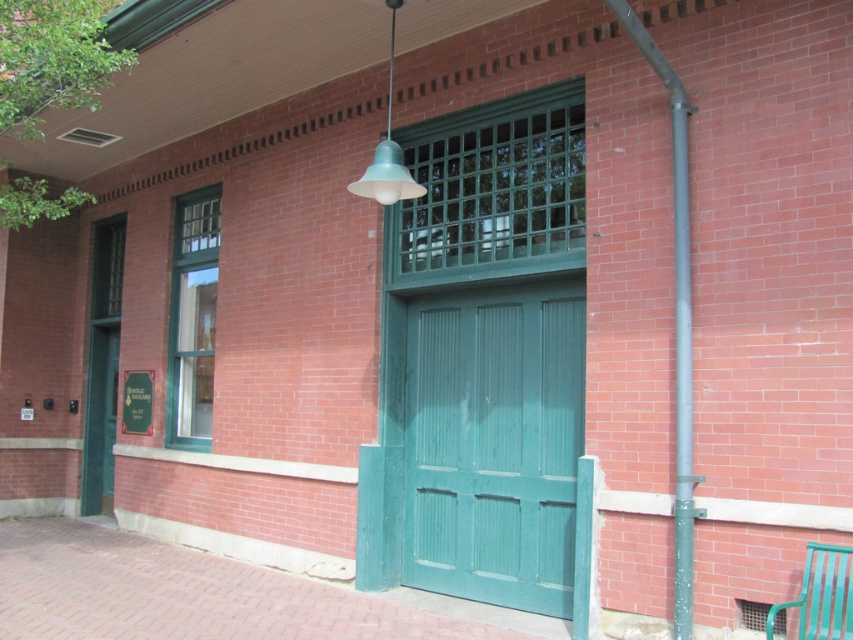
Who is taller, teal wooden door at center or teal glass lampshade at upper center?

teal wooden door at center is taller.

Does teal wooden door at center have a lesser height compared to teal glass lampshade at upper center?

In fact, teal wooden door at center may be taller than teal glass lampshade at upper center.

Does point (561, 612) lie in front of point (415, 189)?

No, (561, 612) is further to viewer.

You are a GUI agent. You are given a task and a screenshot of the screen. Output one action in this format:
    pyautogui.click(x=<x>, y=<y>)
    Task: Click on the teal wooden door at center
    The image size is (853, 640).
    Given the screenshot: What is the action you would take?
    pyautogui.click(x=494, y=442)

Can you confirm if teal wooden door at center is positioned to the right of metallic gray pipe at right?

In fact, teal wooden door at center is to the left of metallic gray pipe at right.

Which is in front, point (498, 394) or point (689, 508)?

Point (689, 508) is more forward.

Identify the location of teal wooden door at center. The width and height of the screenshot is (853, 640). (494, 442).

How far apart are metallic gray pipe at right and green metal bench at lower right?

metallic gray pipe at right and green metal bench at lower right are 34.32 inches apart.

Which is behind, point (682, 310) or point (840, 637)?

The point (682, 310) is more distant.

The height and width of the screenshot is (640, 853). What are the coordinates of `metallic gray pipe at right` in the screenshot? It's located at (676, 321).